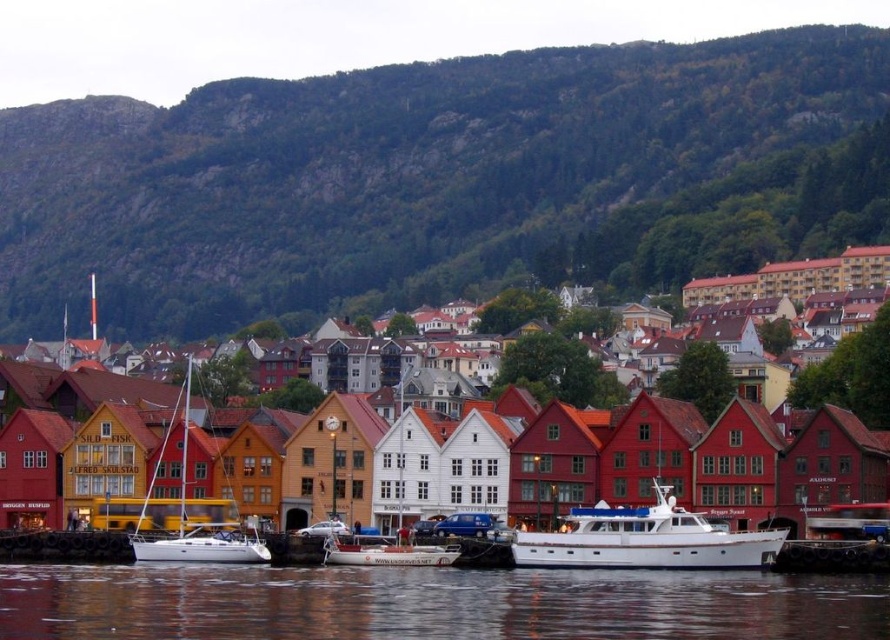
Question: Does transparent water at lower center appear on the left side of white glossy boat at center?

Choices:
 (A) yes
 (B) no

Answer: (A)

Question: Which point is farther to the camera?

Choices:
 (A) (185, 464)
 (B) (406, 554)

Answer: (A)

Question: Based on their relative distances, which object is farther from the green forested hillside at upper center?

Choices:
 (A) white glossy boat at center
 (B) wooden houses at center
 (C) transparent water at lower center

Answer: (A)

Question: Which of the following is the farthest from the observer?

Choices:
 (A) (216, 554)
 (B) (654, 566)
 (C) (405, 92)

Answer: (C)

Question: Is white glossy boat at center thinner than white matte sailboat at center?

Choices:
 (A) yes
 (B) no

Answer: (B)

Question: Can you confirm if wooden houses at center is wider than white glossy boat at center?

Choices:
 (A) yes
 (B) no

Answer: (A)